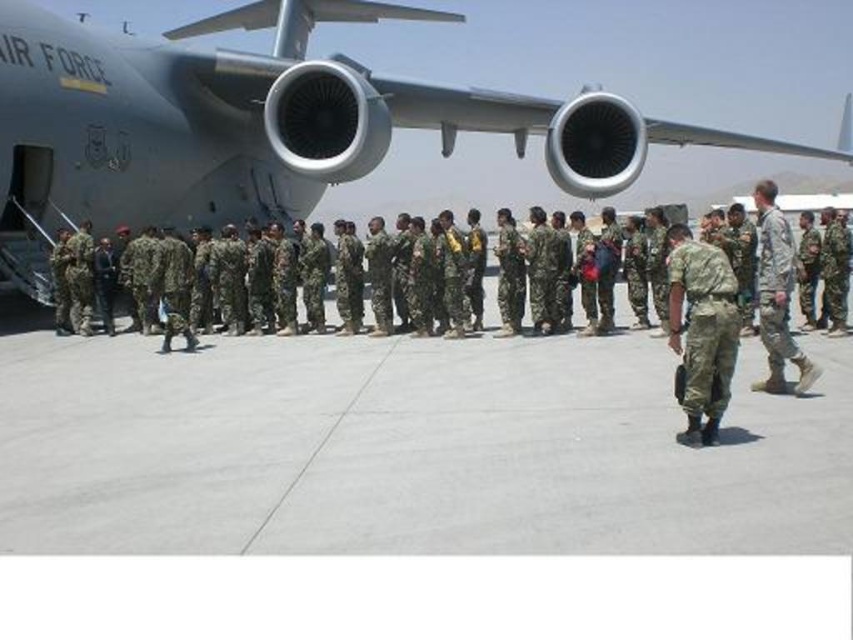
Question: Which of the following is the farthest from the observer?

Choices:
 (A) (697, 260)
 (B) (448, 16)

Answer: (B)

Question: Does camouflage fabric pants at center appear on the right side of camouflage fabric uniform at right?

Choices:
 (A) no
 (B) yes

Answer: (A)

Question: Which object is the farthest from the camouflage uniform at center?

Choices:
 (A) metallic gray airplane at upper center
 (B) camouflage fabric pants at center

Answer: (A)

Question: Which point is farther to the camera?

Choices:
 (A) camouflage fabric pants at center
 (B) camouflage fabric uniform at right

Answer: (B)

Question: From the image, what is the correct spatial relationship of gray concrete tarmac at center in relation to metallic gray airplane at upper center?

Choices:
 (A) right
 (B) left

Answer: (B)

Question: Considering the relative positions of metallic gray airplane at upper center and camouflage fabric uniform at right in the image provided, where is metallic gray airplane at upper center located with respect to camouflage fabric uniform at right?

Choices:
 (A) below
 (B) above

Answer: (B)